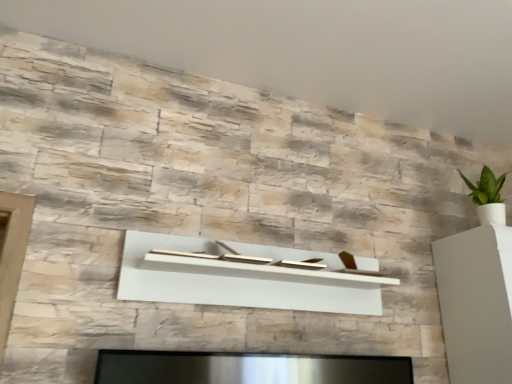
Question: Does natural stone wall at upper center have a lesser width compared to white glossy vase at right?

Choices:
 (A) yes
 (B) no

Answer: (B)

Question: Does natural stone wall at upper center have a greater width compared to white glossy vase at right?

Choices:
 (A) no
 (B) yes

Answer: (B)

Question: Does natural stone wall at upper center lie in front of white glossy vase at right?

Choices:
 (A) yes
 (B) no

Answer: (A)

Question: From the image's perspective, does natural stone wall at upper center appear lower than white glossy vase at right?

Choices:
 (A) no
 (B) yes

Answer: (A)

Question: Is white glossy vase at right a part of natural stone wall at upper center?

Choices:
 (A) no
 (B) yes

Answer: (A)

Question: Is natural stone wall at upper center not within white glossy vase at right?

Choices:
 (A) yes
 (B) no

Answer: (A)

Question: Does white matte shelf at center appear on the left side of natural stone wall at upper center?

Choices:
 (A) no
 (B) yes

Answer: (B)

Question: Considering the relative sizes of white matte shelf at center and natural stone wall at upper center in the image provided, is white matte shelf at center thinner than natural stone wall at upper center?

Choices:
 (A) no
 (B) yes

Answer: (B)

Question: Does white matte shelf at center have a lesser height compared to natural stone wall at upper center?

Choices:
 (A) yes
 (B) no

Answer: (B)

Question: Would you say white matte shelf at center contains natural stone wall at upper center?

Choices:
 (A) yes
 (B) no

Answer: (B)

Question: From the image's perspective, is white matte shelf at center located above natural stone wall at upper center?

Choices:
 (A) yes
 (B) no

Answer: (B)

Question: Is white matte shelf at center oriented away from natural stone wall at upper center?

Choices:
 (A) yes
 (B) no

Answer: (B)

Question: Is white glossy vase at right positioned with its back to natural stone wall at upper center?

Choices:
 (A) yes
 (B) no

Answer: (B)